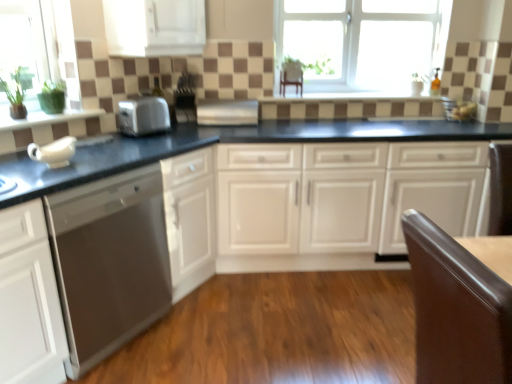
You are a GUI agent. You are given a task and a screenshot of the screen. Output one action in this format:
    pyautogui.click(x=<x>, y=<y>)
    Task: Click on the free space underneath satin silver toaster at center, marked as the 2th appliance in a left-to-right arrangement (from a real-world perspective)
    The height and width of the screenshot is (384, 512).
    Given the screenshot: What is the action you would take?
    tap(221, 126)